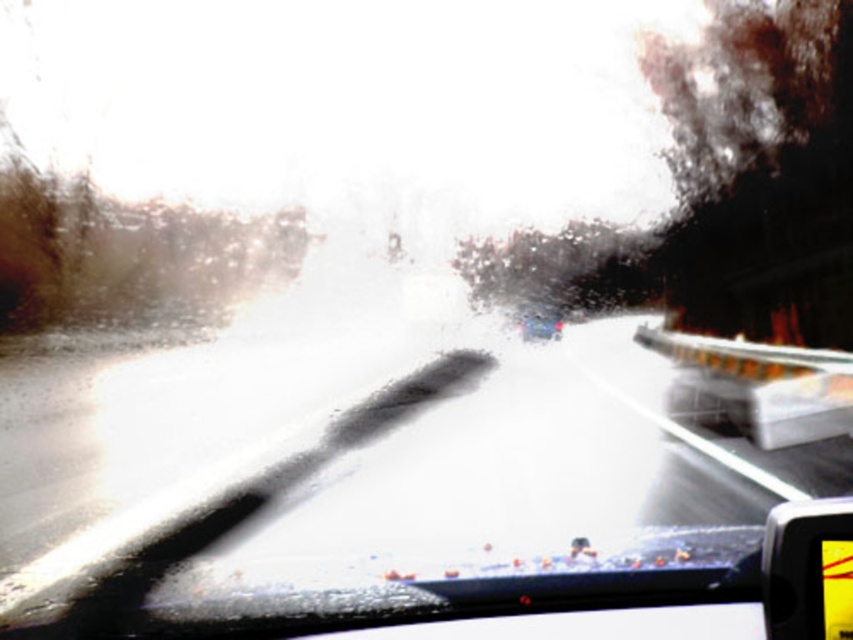
Is yellow plastic view mirror at lower right to the right of metallic silver car at center from the viewer's perspective?

In fact, yellow plastic view mirror at lower right is to the left of metallic silver car at center.

Who is shorter, yellow plastic view mirror at lower right or metallic silver car at center?

Standing shorter between the two is metallic silver car at center.

Does point (850, 516) come farther from viewer compared to point (560, 323)?

No, (850, 516) is in front of (560, 323).

Where is `yellow plastic view mirror at lower right`? This screenshot has width=853, height=640. yellow plastic view mirror at lower right is located at coordinates (808, 570).